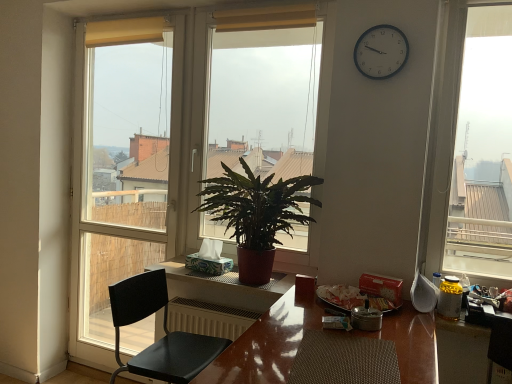
The width and height of the screenshot is (512, 384). I want to click on vacant area on top of yellow fabric curtain at upper center, which ranks as the first curtain in front-to-back order (from a real-world perspective), so click(258, 5).